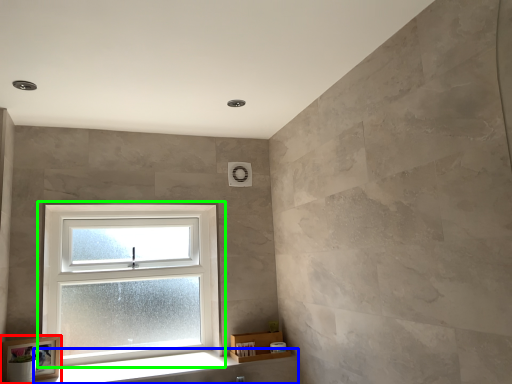
Question: Considering the real-world distances, which object is closest to picture frame (highlighted by a red box)? window sill (highlighted by a blue box) or window (highlighted by a green box).

Choices:
 (A) window sill
 (B) window

Answer: (A)